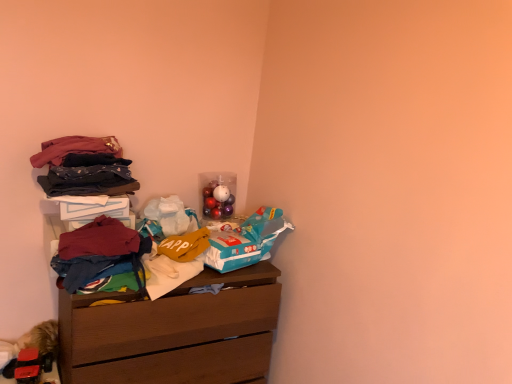
Question: From a real-world perspective, is wooden chest of drawers at upper left above or below dark blue cotton pants at left, marked as the third clothing in a bottom-to-top arrangement?

Choices:
 (A) below
 (B) above

Answer: (A)

Question: Does point (71, 379) appear closer or farther from the camera than point (47, 185)?

Choices:
 (A) farther
 (B) closer

Answer: (A)

Question: Which of these objects is positioned farthest from the maroon fabric shirt at left, which is the 3th clothing in top-to-bottom order?

Choices:
 (A) wooden chest of drawers at upper left
 (B) velvet-like fabric at upper left, the first clothing in the top-to-bottom sequence
 (C) dark blue cotton pants at left, marked as the 2th clothing in a top-to-bottom arrangement
 (D) multicolored fabric at center, which appears as the 4th clothing when viewed from the top

Answer: (A)

Question: Which object is the closest to the wooden chest of drawers at upper left?

Choices:
 (A) maroon fabric shirt at left, which is counted as the second clothing, starting from the bottom
 (B) dark blue cotton pants at left, marked as the third clothing in a bottom-to-top arrangement
 (C) multicolored fabric at center, which is the 1th clothing in bottom-to-top order
 (D) velvet-like fabric at upper left, the fourth clothing ordered from the bottom

Answer: (C)